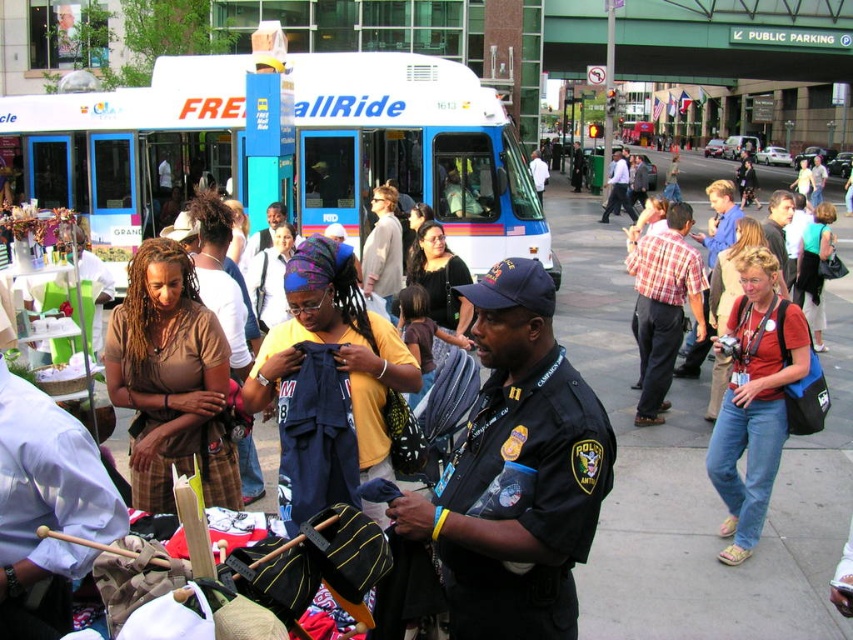
Is concrete sidewalk at center positioned at the back of plaid shirt at center?

No, it is not.

Can you confirm if concrete sidewalk at center is shorter than plaid shirt at center?

No, concrete sidewalk at center is not shorter than plaid shirt at center.

Is point (579, 236) positioned before point (688, 292)?

That is False.

At what (x,y) coordinates should I click in order to perform the action: click on concrete sidewalk at center. Please return your answer as a coordinate pair (x, y). The height and width of the screenshot is (640, 853). Looking at the image, I should click on (694, 476).

Which of these two, yellow cotton shirt at center or plaid shirt at center, stands taller?

plaid shirt at center is taller.

The width and height of the screenshot is (853, 640). I want to click on yellow cotton shirt at center, so click(x=335, y=346).

At what (x,y) coordinates should I click in order to perform the action: click on yellow cotton shirt at center. Please return your answer as a coordinate pair (x, y). Image resolution: width=853 pixels, height=640 pixels. Looking at the image, I should click on (335, 346).

Can you confirm if white plastic bus at center is taller than plaid shirt at center?

Yes.

Which is behind, point (419, 125) or point (699, 300)?

Positioned behind is point (419, 125).

I want to click on white plastic bus at center, so click(x=289, y=150).